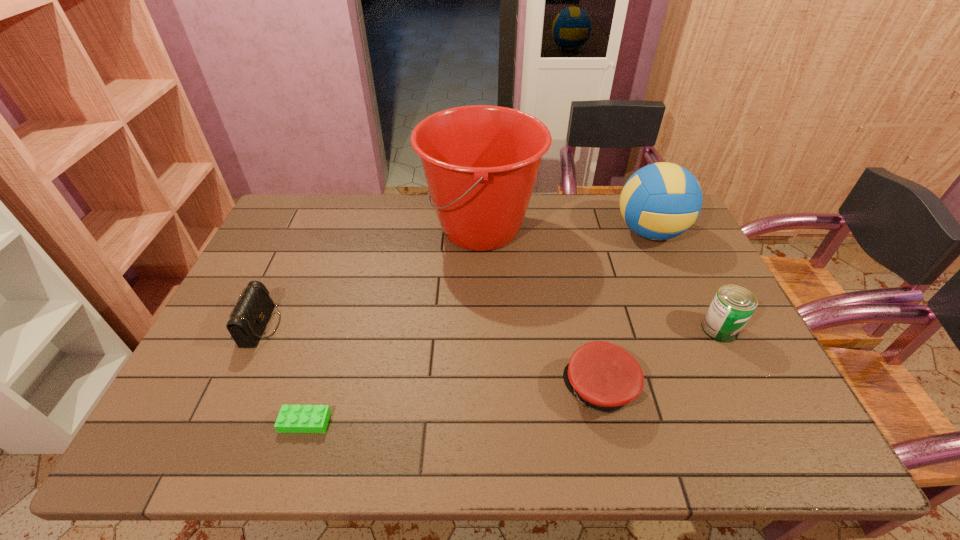
Find the location of a particular element. Image resolution: width=960 pixels, height=540 pixels. empty space that is in between the third tallest object and the Lego is located at coordinates (513, 375).

I want to click on vacant space in between the second object from left to right and the leftmost object, so click(x=283, y=374).

The width and height of the screenshot is (960, 540). Identify the location of object that is the closest to the fifth object from right to left. (253, 309).

Locate which object ranks in proximity to the volleyball. Please provide its 2D coordinates. Your answer should be formatted as a tuple, i.e. [(x, y)], where the tuple contains the x and y coordinates of a point satisfying the conditions above.

[(481, 162)]

Where is `vacant space that satisfies the following two spatial constraints: 1. on the front flap of the can; 2. on the right side of the third shortest object`? The image size is (960, 540). vacant space that satisfies the following two spatial constraints: 1. on the front flap of the can; 2. on the right side of the third shortest object is located at coordinates (260, 329).

Where is `free space that satisfies the following two spatial constraints: 1. on the back side of the Lego; 2. on the right side of the third tallest object`? This screenshot has width=960, height=540. free space that satisfies the following two spatial constraints: 1. on the back side of the Lego; 2. on the right side of the third tallest object is located at coordinates (333, 329).

Where is `free space that satisfies the following two spatial constraints: 1. with the handle attached to the rim of the tallest object; 2. on the back side of the can`? This screenshot has width=960, height=540. free space that satisfies the following two spatial constraints: 1. with the handle attached to the rim of the tallest object; 2. on the back side of the can is located at coordinates (481, 329).

At what (x,y) coordinates should I click in order to perform the action: click on vacant space that satisfies the following two spatial constraints: 1. on the front flap of the leftmost object; 2. on the right side of the Lego. Please return your answer as a coordinate pair (x, y). Looking at the image, I should click on (218, 422).